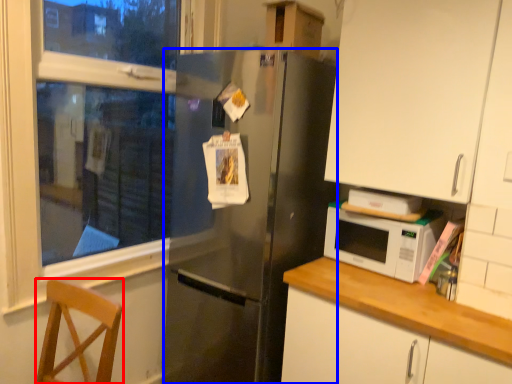
Question: Which object appears closest to the camera in this image, chair (highlighted by a red box) or refrigerator (highlighted by a blue box)?

Choices:
 (A) chair
 (B) refrigerator

Answer: (A)